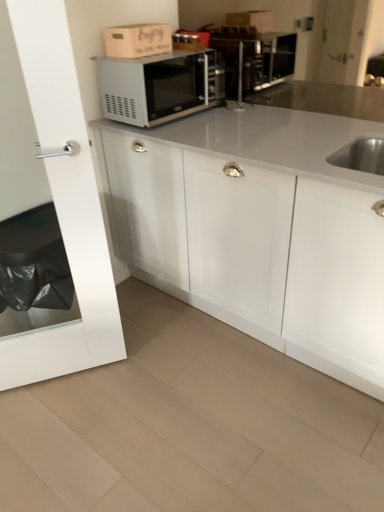
Where is `vacant space to the right of transparent glass door at left`? The image size is (384, 512). vacant space to the right of transparent glass door at left is located at coordinates (141, 376).